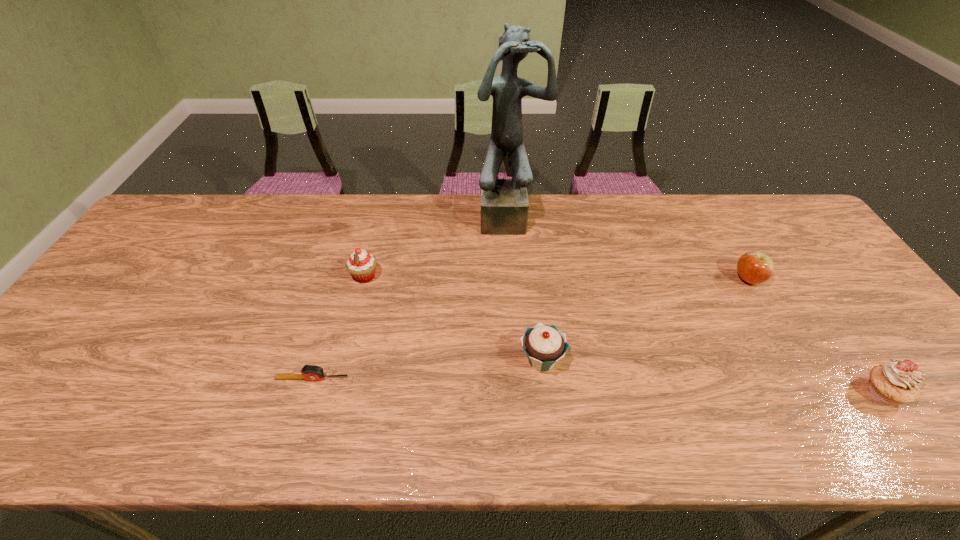
Locate an element on the screen. free region located on the left of the second cupcake from left to right is located at coordinates (386, 360).

Where is `vacant space located on the left of the rightmost cupcake`? The width and height of the screenshot is (960, 540). vacant space located on the left of the rightmost cupcake is located at coordinates (731, 393).

Image resolution: width=960 pixels, height=540 pixels. What are the coordinates of `vacant space located on the front of the fifth tallest object` in the screenshot? It's located at (778, 329).

Identify the location of vacant space located on the back of the shortest object. (325, 333).

This screenshot has width=960, height=540. Find the location of `object at the far edge`. object at the far edge is located at coordinates (504, 202).

Locate an element on the screen. The image size is (960, 540). object present at the near edge is located at coordinates (896, 382).

Image resolution: width=960 pixels, height=540 pixels. Find the location of `object that is at the right edge`. object that is at the right edge is located at coordinates (896, 382).

Where is `object that is positioned at the near right corner`? object that is positioned at the near right corner is located at coordinates (896, 382).

Find the location of `free space at the far edge of the desktop`. free space at the far edge of the desktop is located at coordinates (384, 201).

In the image, there is a desktop. At what (x,y) coordinates should I click in order to perform the action: click on vacant space at the near edge. Please return your answer as a coordinate pair (x, y). The width and height of the screenshot is (960, 540). Looking at the image, I should click on (554, 432).